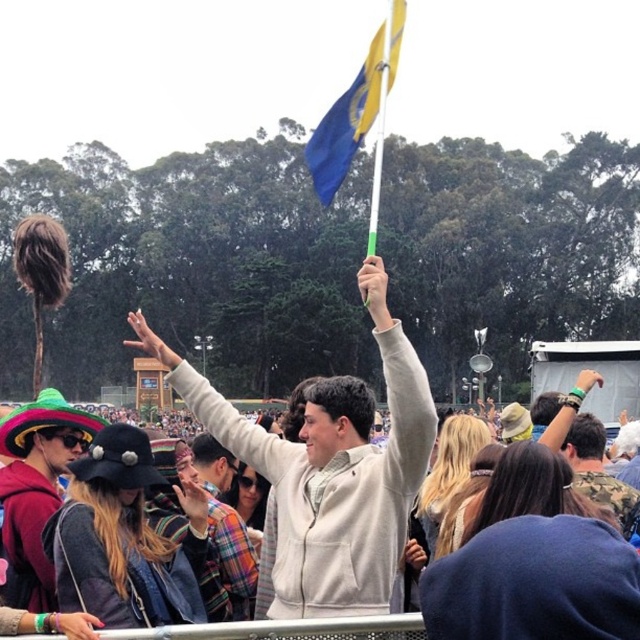
You are attending a festival in the park and notice a light gray fleece jacket at center and a blue fabric flag at upper center. Which object is positioned higher in the scene?

The blue fabric flag at upper center is positioned higher than the light gray fleece jacket at center.